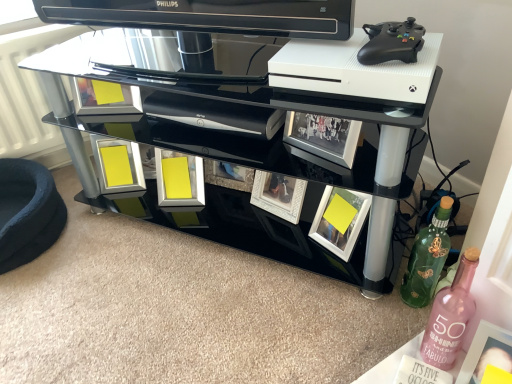
At what (x,y) coordinates should I click in order to perform the action: click on free space to the back side of white glossy magazine at lower right. Please return your answer as a coordinate pair (x, y). Looking at the image, I should click on coord(378,319).